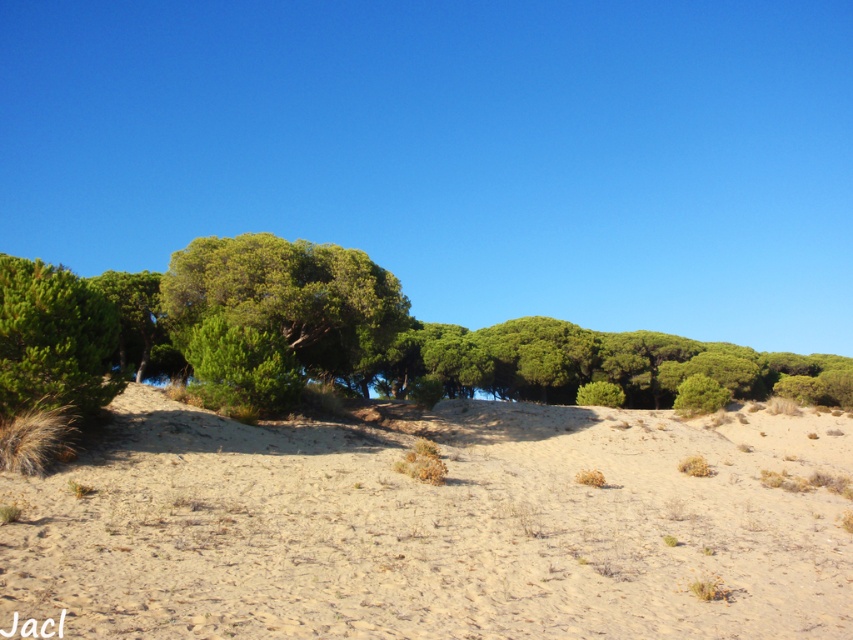
Consider the image. You are a hiker planning to cross the sandy terrain in the image. You notice the green leafy trees at center and the green leafy tree at upper left. Which tree would provide more shade for resting?

The green leafy trees at center would provide more shade for resting since it is taller than the green leafy tree at upper left, creating a larger shaded area.

You are planning to plant a new tree in this landscape. The new tree will be the same size as the green leafy tree at upper left. Where should you plant it so that it doesn not block the view of the larger green leafy trees at center?

You should plant the new tree the same size as the green leafy tree at upper left away from the area where the green leafy trees at center are located. Since the green leafy trees at center are wider, placing the smaller tree at a distance or in a different section of the landscape will ensure it doesn not obstruct the view of the larger trees.

You are standing on the light beige sand in the foreground and looking towards the green leafy trees at center and the green leafy tree at upper left. Which of these two objects is closer to your current position?

The green leafy trees at center is closer to your current position because it is positioned below the green leafy tree at upper left, indicating it is in a lower part of the image which corresponds to the midground, whereas the tree at upper left is in the background.